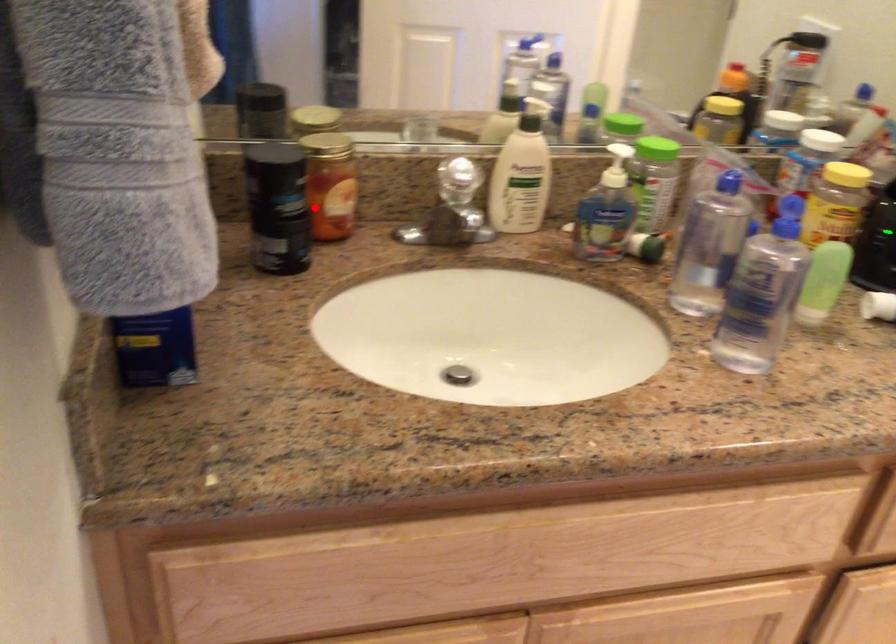
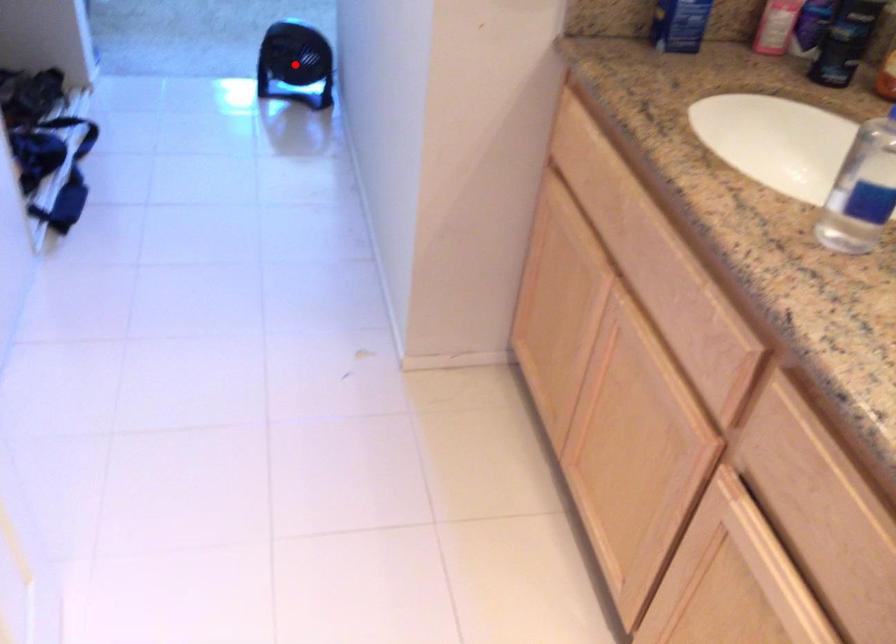
I am providing you with two images of the same scene from different viewpoints. A red point is marked on the first image and another point is marked on the second image. Does the point marked in image1 correspond to the same location as the one in image2?

No